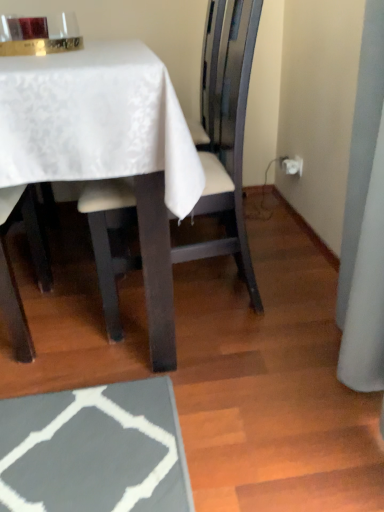
The height and width of the screenshot is (512, 384). In order to click on white satin table at upper left in this screenshot , I will do `click(96, 121)`.

This screenshot has width=384, height=512. Describe the element at coordinates (96, 121) in the screenshot. I see `white satin table at upper left` at that location.

What do you see at coordinates (228, 139) in the screenshot? Image resolution: width=384 pixels, height=512 pixels. I see `white leather chair at center` at bounding box center [228, 139].

At what (x,y) coordinates should I click in order to perform the action: click on white leather chair at center. Please return your answer as a coordinate pair (x, y). The height and width of the screenshot is (512, 384). Looking at the image, I should click on (228, 139).

Identify the location of white satin table at upper left. The image size is (384, 512). (96, 121).

Which is more to the left, white leather chair at center or white satin table at upper left?

white satin table at upper left.

Considering the positions of objects white leather chair at center and white satin table at upper left in the image provided, who is in front, white leather chair at center or white satin table at upper left?

Positioned in front is white satin table at upper left.

Considering the points (249, 57) and (102, 158), which point is in front, point (249, 57) or point (102, 158)?

The point (102, 158) is more forward.

From the image's perspective, is white leather chair at center located beneath white satin table at upper left?

Yes.

From a real-world perspective, which object rests below the other?

white satin table at upper left, from a real-world perspective.

Considering the relative sizes of white leather chair at center and white satin table at upper left in the image provided, is white leather chair at center wider than white satin table at upper left?

No.

Consider the image. Between white leather chair at center and white satin table at upper left, which one has more height?

With more height is white leather chair at center.

Based on their sizes in the image, would you say white leather chair at center is bigger or smaller than white satin table at upper left?

Clearly, white leather chair at center is smaller in size than white satin table at upper left.

Is white satin table at upper left inside white leather chair at center?

That's incorrect, white satin table at upper left is not inside white leather chair at center.

Is white leather chair at center with white satin table at upper left?

No, white leather chair at center is not beside white satin table at upper left.

Is white leather chair at center aimed at white satin table at upper left?

Yes, white leather chair at center faces towards white satin table at upper left.

Can you tell me how much white leather chair at center and white satin table at upper left differ in facing direction?

88.9 degrees separate the facing orientations of white leather chair at center and white satin table at upper left.

Where is `chair above the white satin table at upper left (from a real-world perspective)`? The width and height of the screenshot is (384, 512). chair above the white satin table at upper left (from a real-world perspective) is located at coordinates (228, 139).

Would you say white satin table at upper left is to the left or to the right of white leather chair at center in the picture?

Clearly, white satin table at upper left is on the left of white leather chair at center in the image.

Which object is closer to the camera, white satin table at upper left or white leather chair at center?

white satin table at upper left is more forward.

Is point (109, 67) closer or farther from the camera than point (254, 307)?

Point (109, 67).

From the picture: From the image's perspective, which is below, white satin table at upper left or white leather chair at center?

From the image's view, white leather chair at center is below.

From a real-world perspective, who is located lower, white satin table at upper left or white leather chair at center?

From a 3D spatial view, white satin table at upper left is below.

Which of these two, white satin table at upper left or white leather chair at center, is thinner?

With smaller width is white leather chair at center.

Considering the sizes of objects white satin table at upper left and white leather chair at center in the image provided, who is taller, white satin table at upper left or white leather chair at center?

Standing taller between the two is white leather chair at center.

Can you confirm if white satin table at upper left is bigger than white leather chair at center?

Yes.

Which is correct: white satin table at upper left is inside white leather chair at center, or outside of it?

white satin table at upper left is spatially situated outside white leather chair at center.

Is there a large distance between white satin table at upper left and white leather chair at center?

No, there isn't a large distance between white satin table at upper left and white leather chair at center.

Does white satin table at upper left turn towards white leather chair at center?

No, white satin table at upper left is not oriented towards white leather chair at center.

What's the angular difference between white satin table at upper left and white leather chair at center's facing directions?

88.9 degrees separate the facing orientations of white satin table at upper left and white leather chair at center.

Where is `table below the white leather chair at center (from a real-world perspective)`? The image size is (384, 512). table below the white leather chair at center (from a real-world perspective) is located at coordinates (96, 121).

Image resolution: width=384 pixels, height=512 pixels. In order to click on table directly beneath the white leather chair at center (from a real-world perspective) in this screenshot , I will do `click(96, 121)`.

Find the location of a particular element. Image resolution: width=384 pixels, height=512 pixels. table above the white leather chair at center (from the image's perspective) is located at coordinates (96, 121).